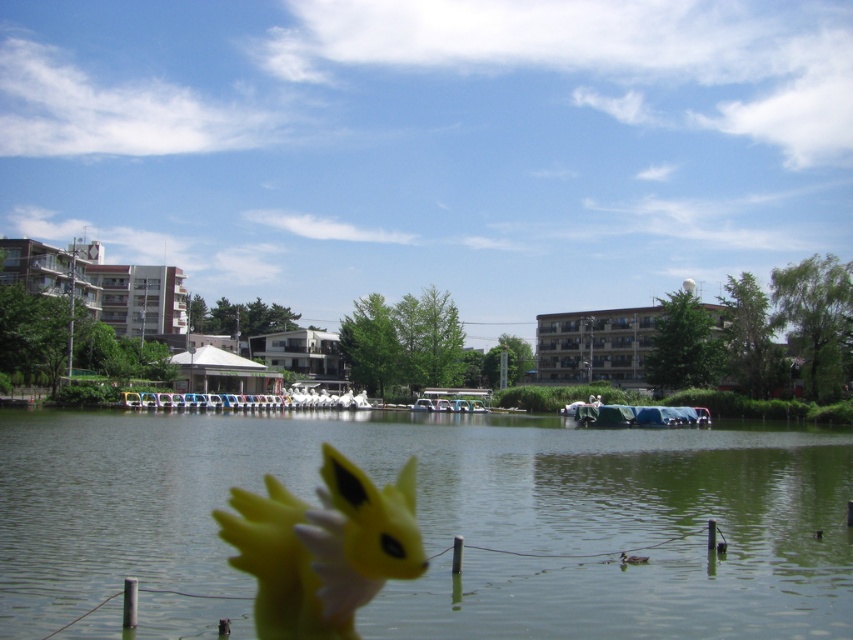
Can you confirm if green smooth water at center is positioned to the right of yellow matte toy at center?

Yes, green smooth water at center is to the right of yellow matte toy at center.

Can you confirm if green smooth water at center is positioned below yellow matte toy at center?

Correct, green smooth water at center is located below yellow matte toy at center.

Find the location of a particular element. green smooth water at center is located at coordinates (445, 518).